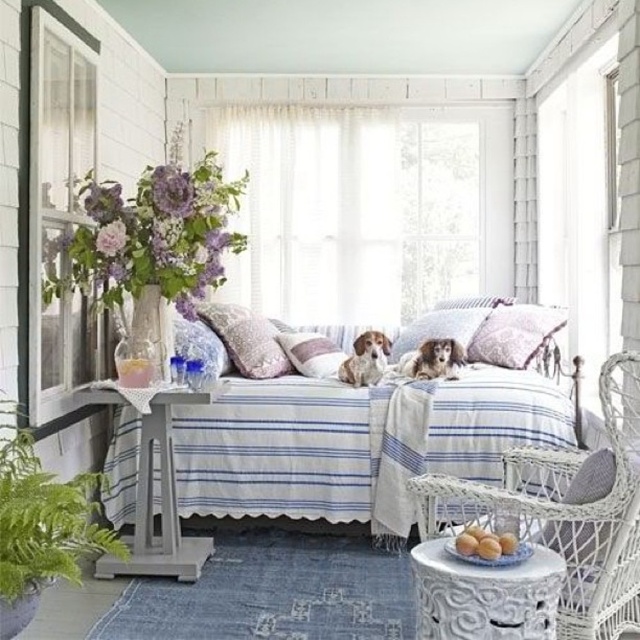
What do you see at coordinates (44, 516) in the screenshot? This screenshot has height=640, width=640. I see `green leafy plant at lower left` at bounding box center [44, 516].

Does green leafy plant at lower left have a greater height compared to white fur dog at center?

Yes, green leafy plant at lower left is taller than white fur dog at center.

Does point (4, 584) lie in front of point (371, 364)?

Yes.

Find the location of a particular element. The image size is (640, 640). green leafy plant at lower left is located at coordinates point(44,516).

Is matte glass vase at left wider than fluffy pink pillow at center?

Indeed, matte glass vase at left has a greater width compared to fluffy pink pillow at center.

Who is more distant from viewer, (204, 250) or (472, 333)?

The point (472, 333) is behind.

Locate an element on the screen. matte glass vase at left is located at coordinates (150, 236).

Between textured lavender pillow at center and shiny brown fur at center, which one is positioned higher?

Positioned higher is textured lavender pillow at center.

Who is lower down, textured lavender pillow at center or shiny brown fur at center?

Positioned lower is shiny brown fur at center.

This screenshot has height=640, width=640. I want to click on textured lavender pillow at center, so click(310, 353).